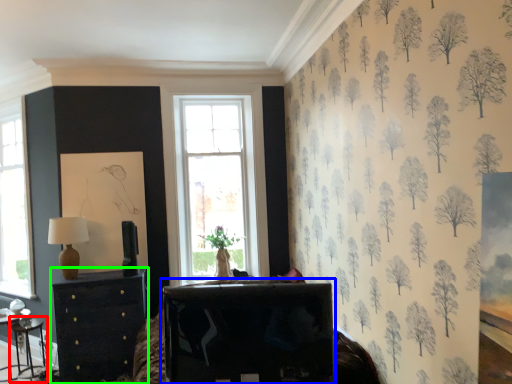
Question: Based on their relative distances, which object is nearer to table (highlighted by a red box)? Choose from table (highlighted by a blue box) and chest of drawers (highlighted by a green box).

Choices:
 (A) table
 (B) chest of drawers

Answer: (B)